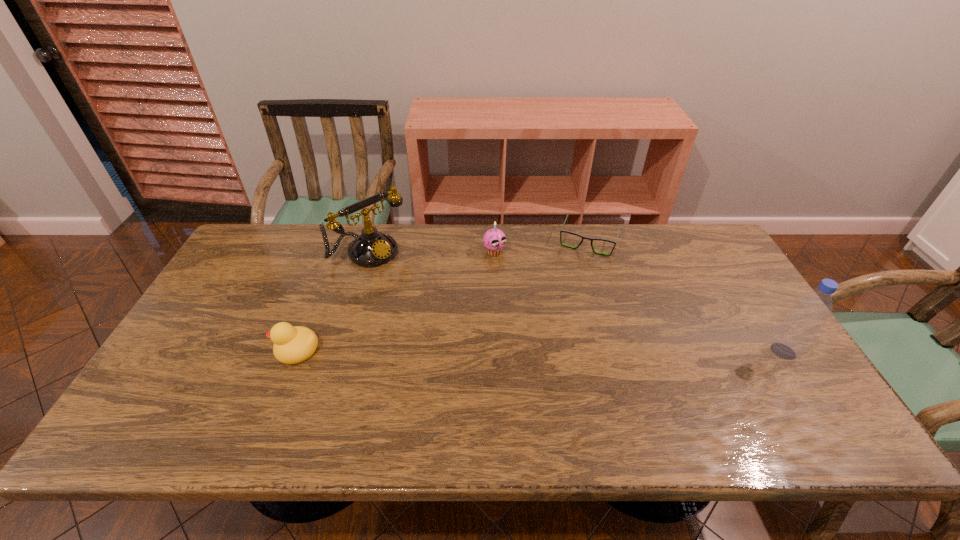
You are a GUI agent. You are given a task and a screenshot of the screen. Output one action in this format:
    pyautogui.click(x=<x>, y=<y>)
    Task: Click on the second shortest object
    
    Given the screenshot: What is the action you would take?
    pyautogui.click(x=292, y=345)

Image resolution: width=960 pixels, height=540 pixels. I want to click on bottle, so click(x=791, y=339).

Find the location of `cupcake`. cupcake is located at coordinates (494, 239).

Identify the location of the third shortest object. (494, 239).

Locate an element on the screen. This screenshot has height=540, width=960. the second tallest object is located at coordinates (372, 248).

Identify the location of the shortest object. (565, 231).

The image size is (960, 540). I want to click on the fourth object from left to right, so click(565, 231).

The width and height of the screenshot is (960, 540). I want to click on vacant space located 0.160m on the face of the duckling, so pos(212,349).

Find the location of a particular element. This screenshot has width=960, height=540. free space located 0.200m on the face of the duckling is located at coordinates (197, 349).

The image size is (960, 540). I want to click on vacant space located 0.120m on the face of the duckling, so click(x=228, y=349).